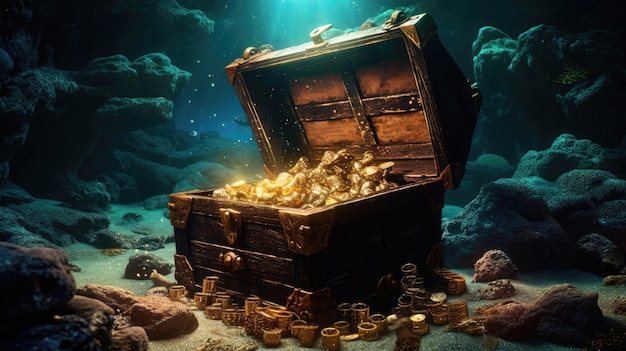
This screenshot has height=351, width=626. What are the coordinates of `treasure chest lid` in the screenshot? It's located at (439, 109).